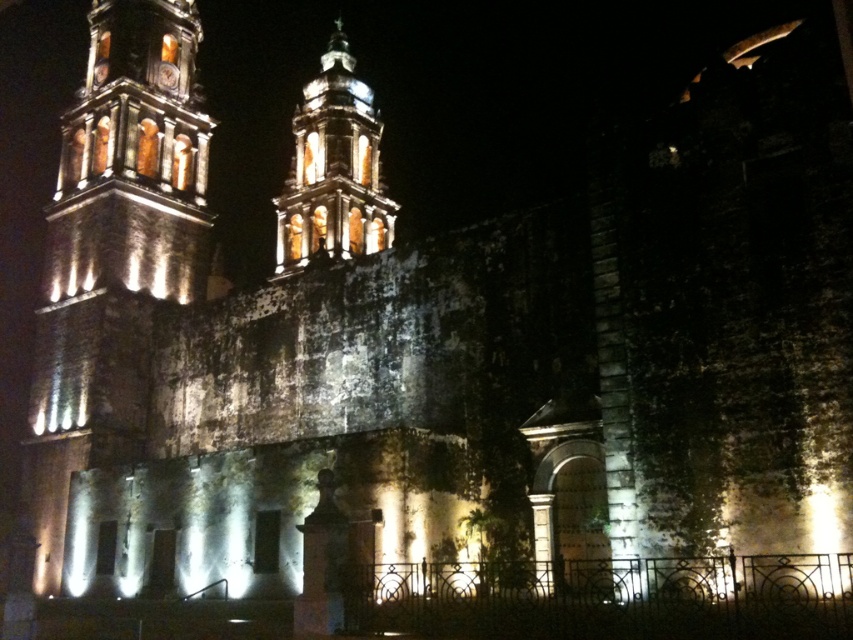
Who is lower down, matte stone tower at left or matte stone tower at center?

matte stone tower at left

Can you confirm if matte stone tower at left is wider than matte stone tower at center?

In fact, matte stone tower at left might be narrower than matte stone tower at center.

Is point (166, 202) behind point (358, 189)?

No, it is not.

Find the location of a particular element. This screenshot has width=853, height=640. matte stone tower at left is located at coordinates (113, 253).